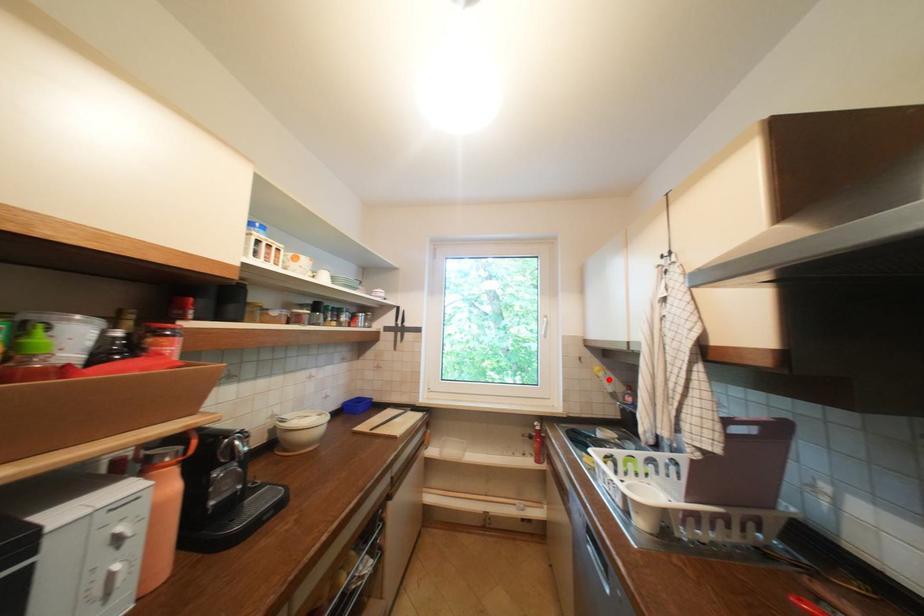
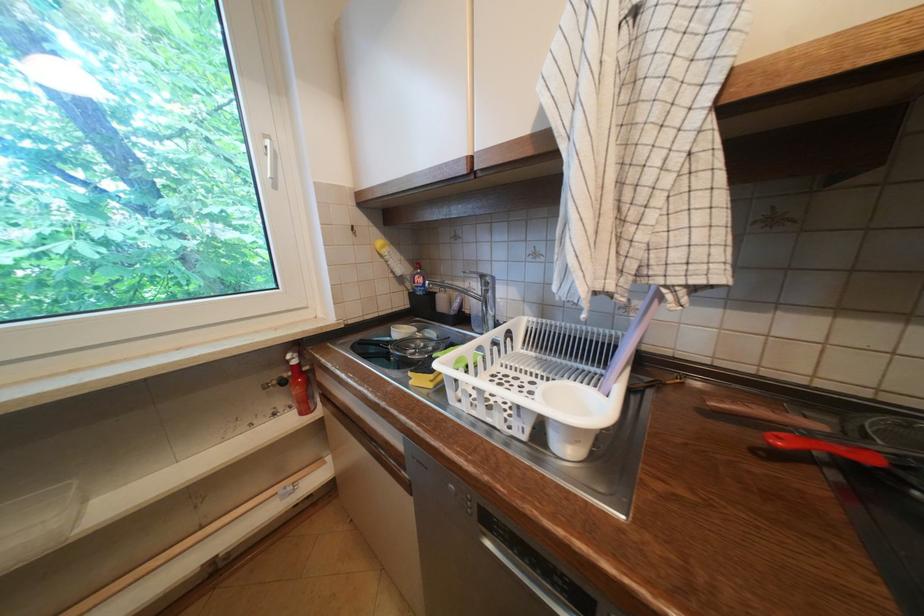
Find the pixel in the second image that matches the highlighted location in the first image.

(394, 259)